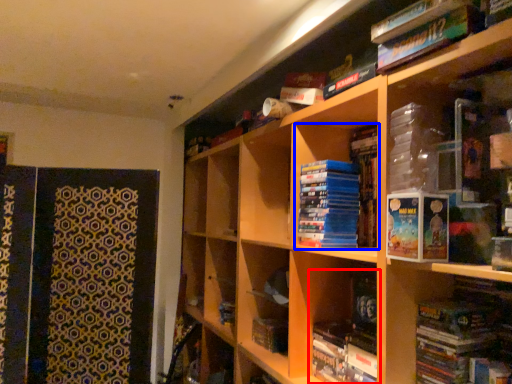
Question: Among these objects, which one is nearest to the camera, book (highlighted by a red box) or book (highlighted by a blue box)?

Choices:
 (A) book
 (B) book

Answer: (A)